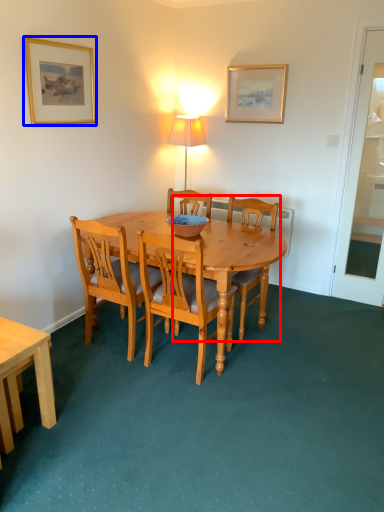
Question: Which object appears closest to the camera in this image, chair (highlighted by a red box) or picture frame (highlighted by a blue box)?

Choices:
 (A) chair
 (B) picture frame

Answer: (B)